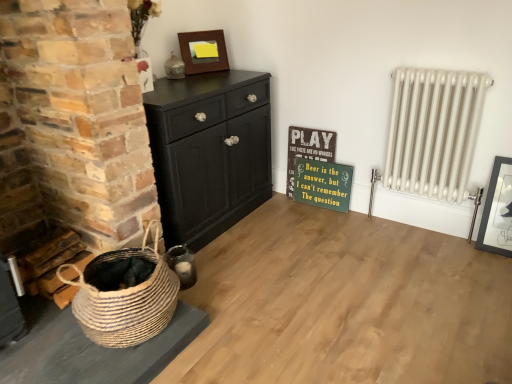
At what (x,y) coordinates should I click in order to perform the action: click on free space between natural woven basket at lower left and white metal radiator at right. Please return your answer as a coordinate pair (x, y). Looking at the image, I should click on (288, 276).